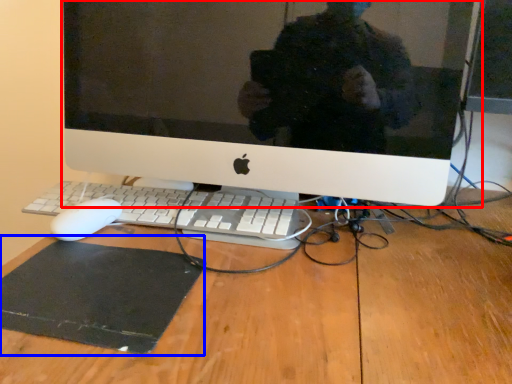
Question: Among these objects, which one is nearest to the camera, computer monitor (highlighted by a red box) or mousepad (highlighted by a blue box)?

Choices:
 (A) computer monitor
 (B) mousepad

Answer: (B)